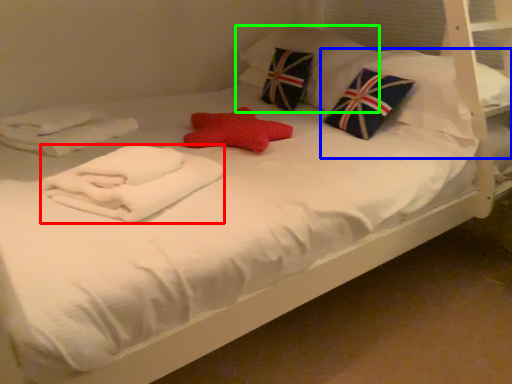
Question: Based on their relative distances, which object is nearer to material (highlighted by a red box)? Choose from pillow (highlighted by a blue box) and pillow (highlighted by a green box).

Choices:
 (A) pillow
 (B) pillow

Answer: (A)